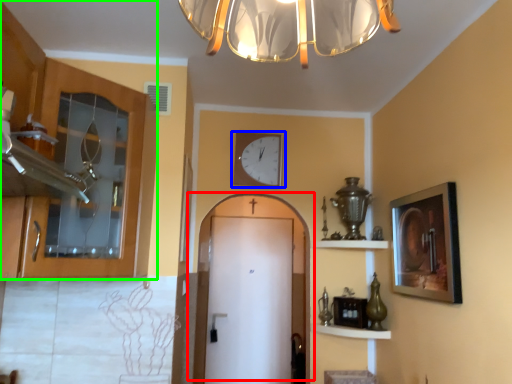
Question: Which object is the farthest from door (highlighted by a red box)? Choose among these: wall clock (highlighted by a blue box) or cabinetry (highlighted by a green box).

Choices:
 (A) wall clock
 (B) cabinetry

Answer: (B)